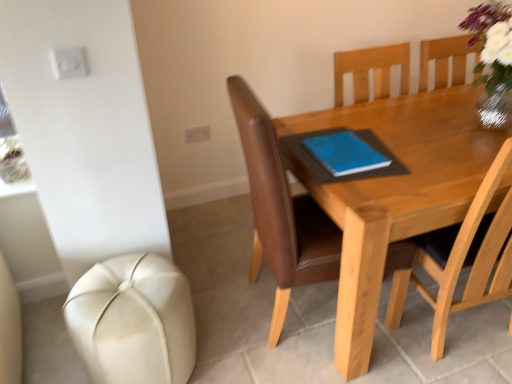
Locate an element on the screen. vacant space to the right of blue matte notebook at center is located at coordinates (418, 155).